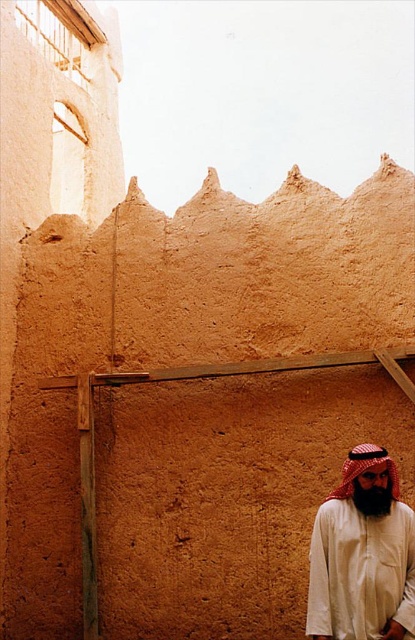
Question: Does white matte headscarf at lower right have a larger size compared to red checkered fabric at lower right?

Choices:
 (A) no
 (B) yes

Answer: (B)

Question: Can you confirm if white matte headscarf at lower right is positioned above red checkered fabric at lower right?

Choices:
 (A) no
 (B) yes

Answer: (A)

Question: Can you confirm if white matte headscarf at lower right is smaller than red checkered fabric at lower right?

Choices:
 (A) no
 (B) yes

Answer: (A)

Question: Which point is closer to the camera?

Choices:
 (A) (351, 470)
 (B) (376, 474)

Answer: (B)

Question: Which point is farther from the camera taking this photo?

Choices:
 (A) (397, 476)
 (B) (371, 515)

Answer: (A)